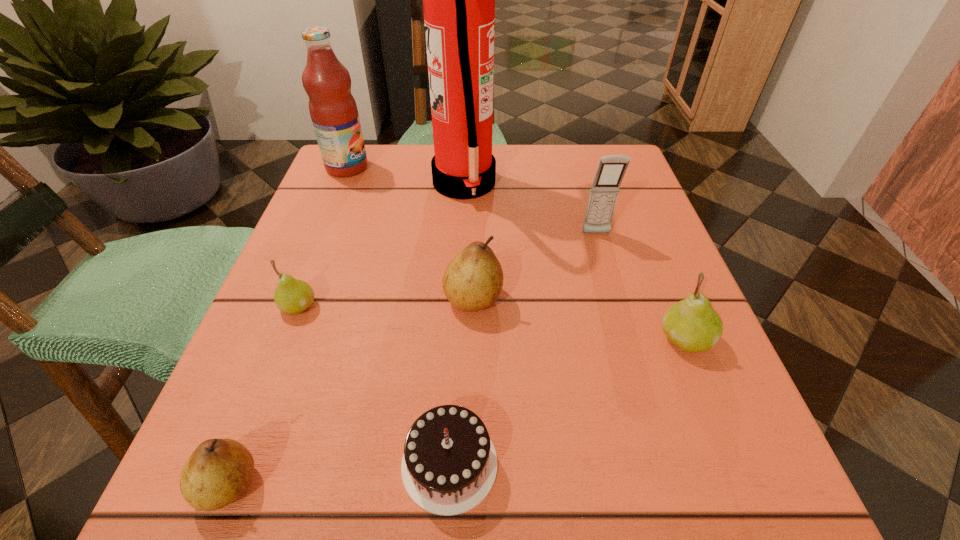
Where is `red fire extinguisher`? This screenshot has width=960, height=540. red fire extinguisher is located at coordinates (458, 0).

I want to click on fire extinguisher, so click(458, 0).

At what (x,y) coordinates should I click in order to perform the action: click on fruit juice. Please return your answer as a coordinate pair (x, y). Looking at the image, I should click on (333, 110).

Where is `the third farthest object`? This screenshot has width=960, height=540. the third farthest object is located at coordinates point(611,169).

Where is `cellular telephone`? The height and width of the screenshot is (540, 960). cellular telephone is located at coordinates (611, 169).

Locate an element on the screen. the second pear from right to left is located at coordinates (473, 280).

This screenshot has width=960, height=540. I want to click on the right brown pear, so click(x=473, y=280).

In order to click on the rightmost pear in this screenshot , I will do `click(692, 325)`.

You are a GUI agent. You are given a task and a screenshot of the screen. Output one action in this format:
    pyautogui.click(x=<x>, y=<y>)
    Task: Click on the bigger green pear
    This screenshot has height=540, width=960.
    Given the screenshot: What is the action you would take?
    pyautogui.click(x=692, y=325)

I want to click on the left green pear, so click(x=292, y=296).